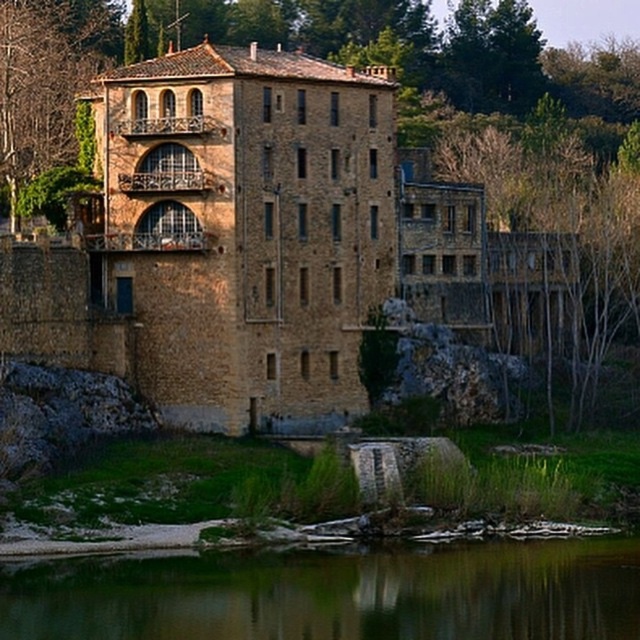
Question: Which of the following is the closest to the observer?

Choices:
 (A) (560, 557)
 (B) (17, 38)
 (C) (33, 173)

Answer: (A)

Question: Can you confirm if green reflective water at lower center is thinner than green leafy tree at upper left?

Choices:
 (A) no
 (B) yes

Answer: (A)

Question: Which point is farther from the camera taking this photo?

Choices:
 (A) (108, 218)
 (B) (365, 621)

Answer: (A)

Question: Which point appears closest to the camera in this image?

Choices:
 (A) (355, 284)
 (B) (104, 6)

Answer: (A)

Question: Does green leafy tree at upper center appear on the right side of green reflective water at lower center?

Choices:
 (A) yes
 (B) no

Answer: (B)

Question: Does green reflective water at lower center appear under green leafy tree at upper left?

Choices:
 (A) no
 (B) yes

Answer: (B)